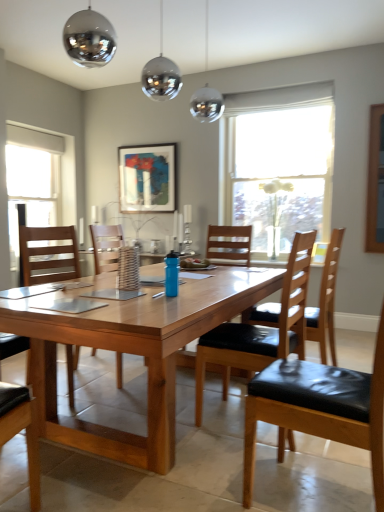
In order to click on free location to the left of black leather chair at right, marked as the second chair in a right-to-left arrangement in this screenshot , I will do `click(209, 478)`.